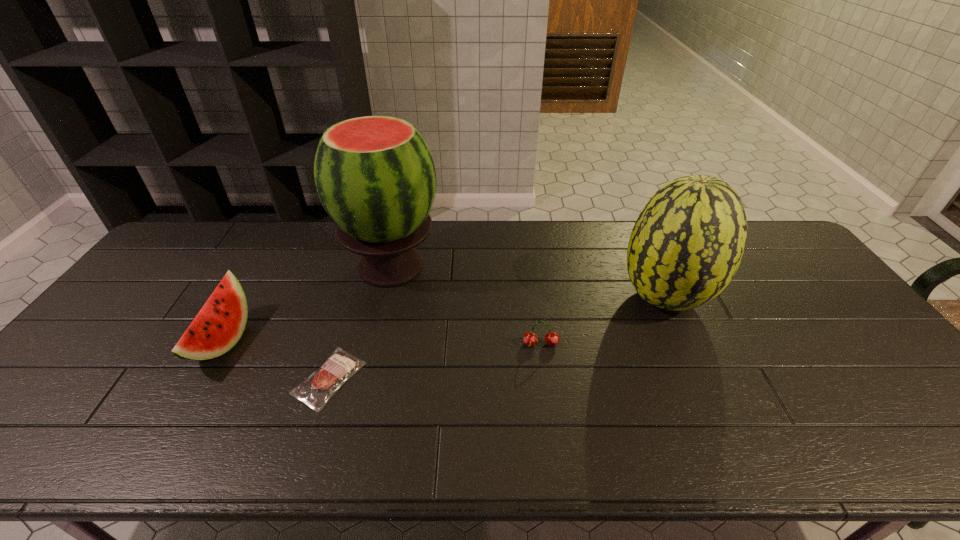
Locate an element on the screen. Image resolution: width=960 pixels, height=540 pixels. vacant space located on the outer rind of the leftmost object is located at coordinates (318, 341).

Locate an element on the screen. The image size is (960, 540). free location located with stems pointing upwards on the fourth tallest object is located at coordinates (551, 419).

You are a GUI agent. You are given a task and a screenshot of the screen. Output one action in this format:
    pyautogui.click(x=<x>, y=<y>)
    Task: Click on the vacant space situated 0.100m on the front of the shortest object
    The image size is (960, 540).
    Given the screenshot: What is the action you would take?
    pyautogui.click(x=305, y=455)

Where is `object that is positioned at the far edge`? Image resolution: width=960 pixels, height=540 pixels. object that is positioned at the far edge is located at coordinates pos(375,176).

Where is `vacant space at the far edge`? vacant space at the far edge is located at coordinates (507, 228).

The height and width of the screenshot is (540, 960). I want to click on vacant space at the near edge of the desktop, so click(x=147, y=464).

This screenshot has height=540, width=960. I want to click on blank area at the left edge, so click(x=116, y=320).

Identify the location of vacant space at the right edge of the desktop. The width and height of the screenshot is (960, 540). tap(819, 295).

The height and width of the screenshot is (540, 960). Identify the location of vacant position at the far left corner of the desktop. (221, 232).

The width and height of the screenshot is (960, 540). I want to click on vacant area that lies between the shortest object and the leftmost object, so pyautogui.click(x=276, y=360).